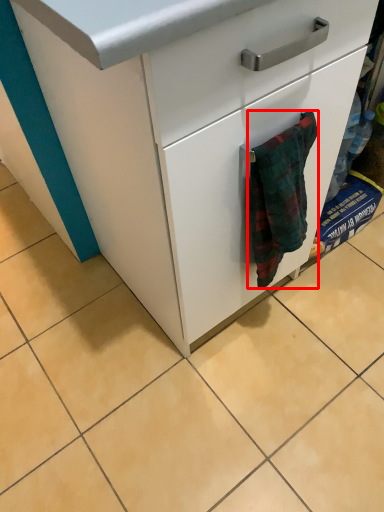
Question: Observing the image, what is the correct spatial positioning of bath towel (annotated by the red box) in reference to chest of drawers?

Choices:
 (A) right
 (B) left

Answer: (B)